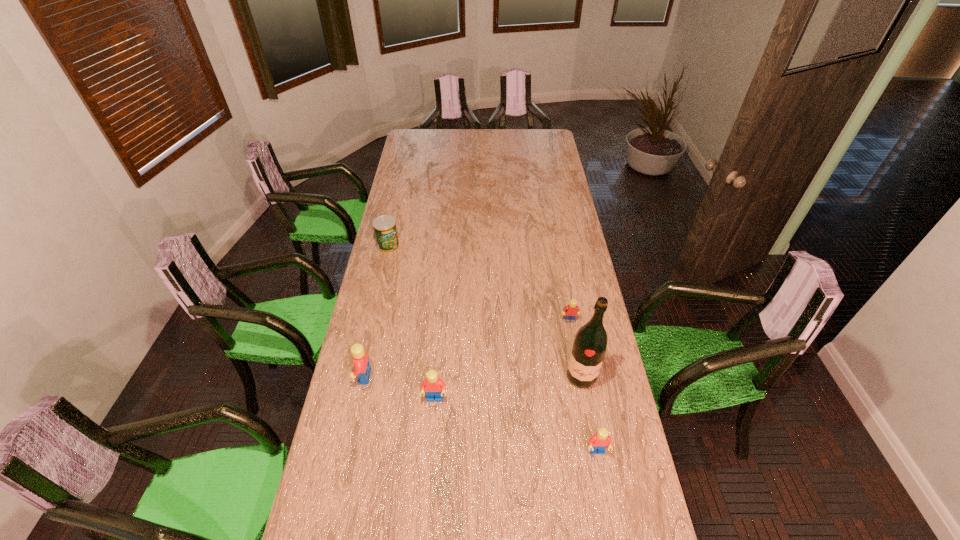
The height and width of the screenshot is (540, 960). What are the coordinates of `vacant area located on the back of the can` in the screenshot? It's located at click(x=400, y=191).

Image resolution: width=960 pixels, height=540 pixels. In order to click on Lego situated at the left edge in this screenshot , I will do point(361,362).

You are a GUI agent. You are given a task and a screenshot of the screen. Output one action in this format:
    pyautogui.click(x=<x>, y=<y>)
    Task: Click on the can located in the left edge section of the desktop
    This screenshot has width=960, height=540.
    Given the screenshot: What is the action you would take?
    pyautogui.click(x=385, y=230)

Image resolution: width=960 pixels, height=540 pixels. I want to click on liquor that is at the right edge, so click(x=590, y=343).

Where is `free space at the far edge of the desktop`? free space at the far edge of the desktop is located at coordinates (493, 143).

Find the location of `vacant space at the left edge of the desktop`. vacant space at the left edge of the desktop is located at coordinates (394, 182).

Locate an element on the screen. free space at the right edge is located at coordinates (538, 154).

You are a GUI agent. You are given a task and a screenshot of the screen. Output one action in this format:
    pyautogui.click(x=<x>, y=<y>)
    Task: Click on the free space between the nearest object and the farthest object
    The image size is (960, 540).
    Given the screenshot: What is the action you would take?
    pyautogui.click(x=492, y=349)

Where is `free space that is in between the liquor and the second Lego from left to right`? Image resolution: width=960 pixels, height=540 pixels. free space that is in between the liquor and the second Lego from left to right is located at coordinates (508, 388).

Locate an element on the screen. free space between the farthest Lego and the can is located at coordinates (479, 283).